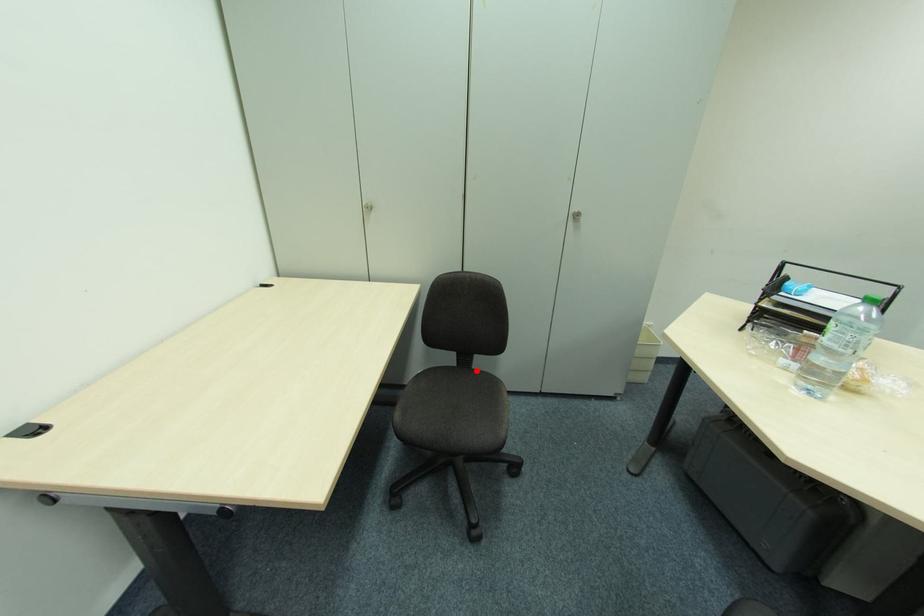
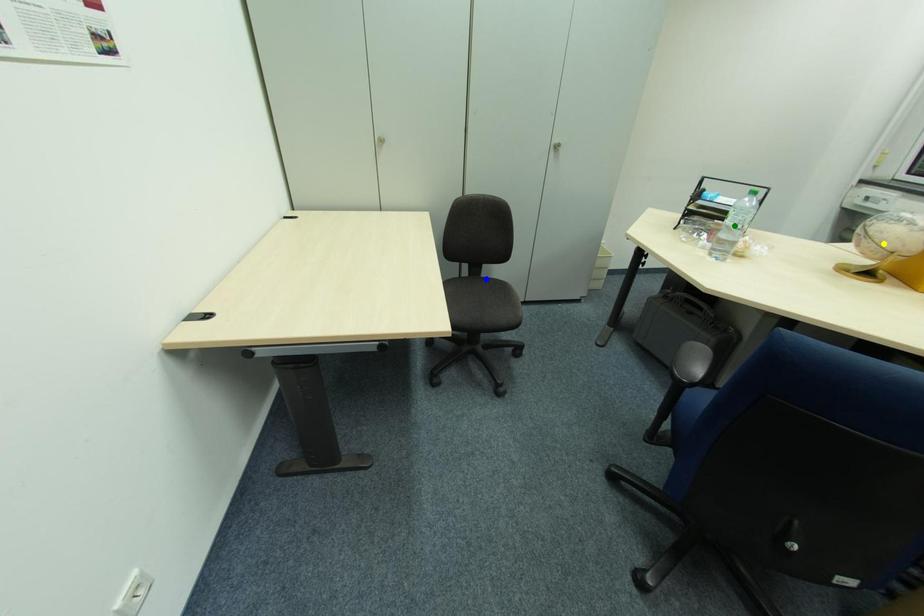
Question: I am providing you with two images of the same scene from different viewpoints. A red point is marked on the first image. You are given multiple points on the second image. In image 2, which mark is for the same physical point as the one in image 1?

Choices:
 (A) blue point
 (B) yellow point
 (C) green point

Answer: (A)